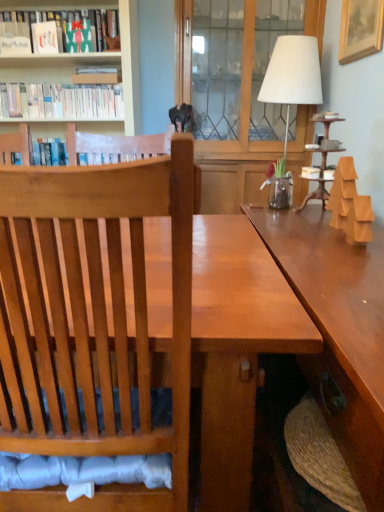
Question: Does gold wooden picture frame at upper right come in front of matte cardboard box at upper left, which appears as the second book when viewed from the top?

Choices:
 (A) no
 (B) yes

Answer: (B)

Question: From the image's perspective, is gold wooden picture frame at upper right located beneath matte cardboard box at upper left, positioned as the 2th book in bottom-to-top order?

Choices:
 (A) no
 (B) yes

Answer: (A)

Question: Can you confirm if gold wooden picture frame at upper right is smaller than matte cardboard box at upper left, positioned as the 2th book in bottom-to-top order?

Choices:
 (A) no
 (B) yes

Answer: (B)

Question: From a real-world perspective, does gold wooden picture frame at upper right stand above matte cardboard box at upper left, which appears as the second book when viewed from the top?

Choices:
 (A) yes
 (B) no

Answer: (A)

Question: Could you tell me if gold wooden picture frame at upper right is turned towards matte cardboard box at upper left, positioned as the 2th book in bottom-to-top order?

Choices:
 (A) yes
 (B) no

Answer: (A)

Question: Considering the relative sizes of gold wooden picture frame at upper right and matte cardboard box at upper left, which appears as the second book when viewed from the top, in the image provided, is gold wooden picture frame at upper right taller than matte cardboard box at upper left, which appears as the second book when viewed from the top,?

Choices:
 (A) no
 (B) yes

Answer: (B)

Question: Does matte cardboard box at upper left, positioned as the 2th book in bottom-to-top order, lie behind shiny brown table at center?

Choices:
 (A) yes
 (B) no

Answer: (A)

Question: Can you confirm if matte cardboard box at upper left, positioned as the 2th book in bottom-to-top order, is smaller than shiny brown table at center?

Choices:
 (A) no
 (B) yes

Answer: (B)

Question: Is matte cardboard box at upper left, positioned as the 2th book in bottom-to-top order, wider than shiny brown table at center?

Choices:
 (A) no
 (B) yes

Answer: (A)

Question: From a real-world perspective, is matte cardboard box at upper left, positioned as the 2th book in bottom-to-top order, physically above shiny brown table at center?

Choices:
 (A) no
 (B) yes

Answer: (B)

Question: From a real-world perspective, is matte cardboard box at upper left, which appears as the second book when viewed from the top, under shiny brown table at center?

Choices:
 (A) yes
 (B) no

Answer: (B)

Question: Considering the relative sizes of matte cardboard box at upper left, which appears as the second book when viewed from the top, and shiny brown table at center in the image provided, is matte cardboard box at upper left, which appears as the second book when viewed from the top, shorter than shiny brown table at center?

Choices:
 (A) yes
 (B) no

Answer: (A)

Question: Can you confirm if white fabric lampshade at upper right is wider than matte green book at upper left, which is counted as the first book, starting from the top?

Choices:
 (A) yes
 (B) no

Answer: (A)